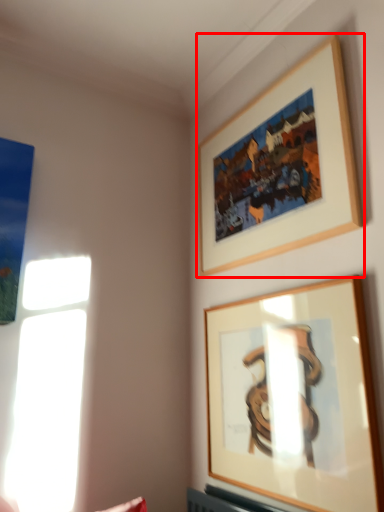
Question: From the image's perspective, considering the relative positions of picture frame (annotated by the red box) and picture frame in the image provided, where is picture frame (annotated by the red box) located with respect to the staircase?

Choices:
 (A) above
 (B) below

Answer: (A)